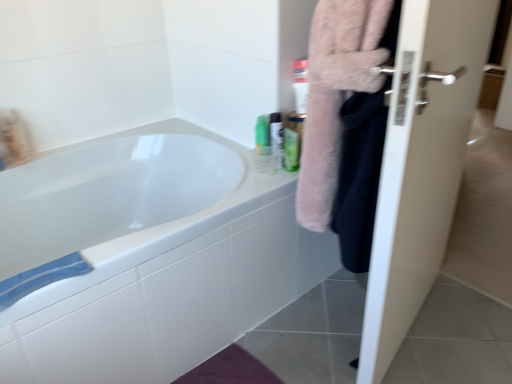
Question: Considering the relative positions of white glossy door at right and white glossy mouthwash at upper right, which appears as the 3th mouthwash when viewed from the left, in the image provided, is white glossy door at right in front of white glossy mouthwash at upper right, which appears as the 3th mouthwash when viewed from the left,?

Choices:
 (A) yes
 (B) no

Answer: (A)

Question: From the image's perspective, is white glossy door at right over white glossy mouthwash at upper right, acting as the 2th mouthwash starting from the right?

Choices:
 (A) no
 (B) yes

Answer: (A)

Question: Is white glossy door at right surrounding white glossy mouthwash at upper right, which appears as the 3th mouthwash when viewed from the left?

Choices:
 (A) no
 (B) yes

Answer: (A)

Question: Could you tell me if white glossy door at right is turned towards white glossy mouthwash at upper right, which appears as the 3th mouthwash when viewed from the left?

Choices:
 (A) no
 (B) yes

Answer: (B)

Question: Is white glossy door at right placed right next to white glossy mouthwash at upper right, which appears as the 3th mouthwash when viewed from the left?

Choices:
 (A) no
 (B) yes

Answer: (A)

Question: From a real-world perspective, is green matte bottle at upper right, placed as the fourth mouthwash when sorted from left to right, physically located above or below white glossy mouthwash at upper right, which appears as the 3th mouthwash when viewed from the left?

Choices:
 (A) above
 (B) below

Answer: (B)

Question: From the image's perspective, relative to white glossy mouthwash at upper right, which appears as the 3th mouthwash when viewed from the left, is green matte bottle at upper right, the first mouthwash from the right, above or below?

Choices:
 (A) above
 (B) below

Answer: (B)

Question: Considering the positions of green matte bottle at upper right, placed as the fourth mouthwash when sorted from left to right, and white glossy mouthwash at upper right, which appears as the 3th mouthwash when viewed from the left, in the image, is green matte bottle at upper right, placed as the fourth mouthwash when sorted from left to right, bigger or smaller than white glossy mouthwash at upper right, which appears as the 3th mouthwash when viewed from the left,?

Choices:
 (A) big
 (B) small

Answer: (B)

Question: Is point (289, 140) closer or farther from the camera than point (274, 137)?

Choices:
 (A) closer
 (B) farther

Answer: (A)

Question: From a real-world perspective, relative to white glossy door at right, is green plastic bottle at upper right, acting as the 2th mouthwash starting from the left, vertically above or below?

Choices:
 (A) below
 (B) above

Answer: (B)

Question: Considering the positions of green plastic bottle at upper right, placed as the third mouthwash when sorted from right to left, and white glossy door at right in the image, is green plastic bottle at upper right, placed as the third mouthwash when sorted from right to left, bigger or smaller than white glossy door at right?

Choices:
 (A) small
 (B) big

Answer: (A)

Question: Is green plastic bottle at upper right, acting as the 2th mouthwash starting from the left, spatially inside white glossy door at right, or outside of it?

Choices:
 (A) inside
 (B) outside

Answer: (B)

Question: From the image's perspective, is green plastic bottle at upper right, acting as the 2th mouthwash starting from the left, positioned above or below white glossy door at right?

Choices:
 (A) below
 (B) above

Answer: (B)

Question: Looking at their shapes, would you say white glossy door at right is wider or thinner than white glossy mouthwash at upper right, acting as the 2th mouthwash starting from the right?

Choices:
 (A) wide
 (B) thin

Answer: (A)

Question: Relative to white glossy mouthwash at upper right, acting as the 2th mouthwash starting from the right, is white glossy door at right in front or behind?

Choices:
 (A) behind
 (B) front

Answer: (B)